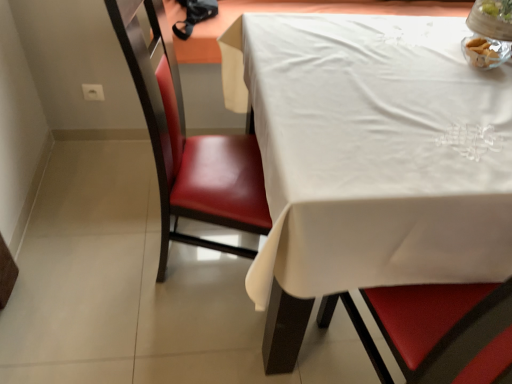
Question: Is white cloth at upper right inside the boundaries of leather at left, or outside?

Choices:
 (A) outside
 (B) inside

Answer: (A)

Question: Is white cloth at upper right in front of or behind leather at left in the image?

Choices:
 (A) front
 (B) behind

Answer: (A)

Question: Estimate the real-world distances between objects in this image. Which object is closer to the clear glass bowl at upper right?

Choices:
 (A) leather at left
 (B) white cloth at upper right

Answer: (B)

Question: Which is farther from the leather at left?

Choices:
 (A) clear glass bowl at upper right
 (B) white cloth at upper right

Answer: (A)